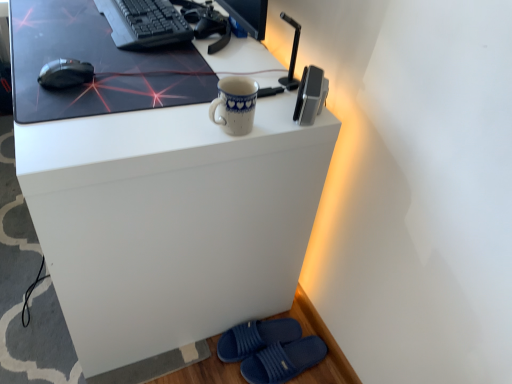
In order to click on free location above black matte keyboard at upper left (from a real-world perspective) in this screenshot , I will do `click(141, 9)`.